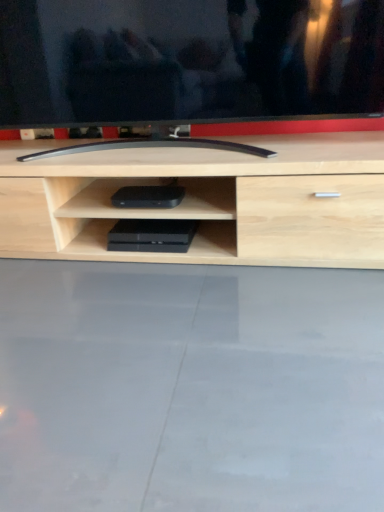
Question: From a real-world perspective, does black glossy tv at center sit lower than black plastic game console at center, the first equipment when ordered from bottom to top?

Choices:
 (A) no
 (B) yes

Answer: (A)

Question: Is the depth of black glossy tv at center less than that of black plastic game console at center, the first equipment when ordered from bottom to top?

Choices:
 (A) no
 (B) yes

Answer: (B)

Question: Is black glossy tv at center at the left side of black plastic game console at center, the first equipment when ordered from bottom to top?

Choices:
 (A) no
 (B) yes

Answer: (A)

Question: From the image's perspective, does black glossy tv at center appear lower than black plastic game console at center, the first equipment when ordered from bottom to top?

Choices:
 (A) yes
 (B) no

Answer: (B)

Question: Does black glossy tv at center have a greater height compared to black plastic game console at center, the first equipment when ordered from bottom to top?

Choices:
 (A) yes
 (B) no

Answer: (A)

Question: From the image's perspective, is black plastic game console at center, positioned as the second equipment in top-to-bottom order, located above or below black plastic device at center, the 2th equipment when ordered from bottom to top?

Choices:
 (A) below
 (B) above

Answer: (A)

Question: Looking at the image, does black plastic game console at center, the first equipment when ordered from bottom to top, seem bigger or smaller compared to black plastic device at center, the 2th equipment when ordered from bottom to top?

Choices:
 (A) small
 (B) big

Answer: (A)

Question: Looking at their shapes, would you say black plastic game console at center, positioned as the second equipment in top-to-bottom order, is wider or thinner than black plastic device at center, the 2th equipment when ordered from bottom to top?

Choices:
 (A) wide
 (B) thin

Answer: (B)

Question: Considering their positions, is black plastic game console at center, positioned as the second equipment in top-to-bottom order, located in front of or behind black plastic device at center, the 2th equipment when ordered from bottom to top?

Choices:
 (A) behind
 (B) front

Answer: (A)

Question: From their relative heights in the image, would you say black plastic device at center, which is the 1th equipment from top to bottom, is taller or shorter than black plastic game console at center, the first equipment when ordered from bottom to top?

Choices:
 (A) short
 (B) tall

Answer: (B)

Question: Based on their positions, is black plastic device at center, the 2th equipment when ordered from bottom to top, located to the left or right of black plastic game console at center, the first equipment when ordered from bottom to top?

Choices:
 (A) right
 (B) left

Answer: (A)

Question: From the image's perspective, is black plastic device at center, which is the 1th equipment from top to bottom, positioned above or below black plastic game console at center, positioned as the second equipment in top-to-bottom order?

Choices:
 (A) above
 (B) below

Answer: (A)

Question: Is point (120, 196) closer or farther from the camera than point (163, 233)?

Choices:
 (A) farther
 (B) closer

Answer: (B)

Question: From a real-world perspective, is black glossy tv at center physically located above or below black plastic game console at center, the first equipment when ordered from bottom to top?

Choices:
 (A) below
 (B) above

Answer: (B)

Question: Does point (89, 74) appear closer or farther from the camera than point (185, 226)?

Choices:
 (A) farther
 (B) closer

Answer: (B)